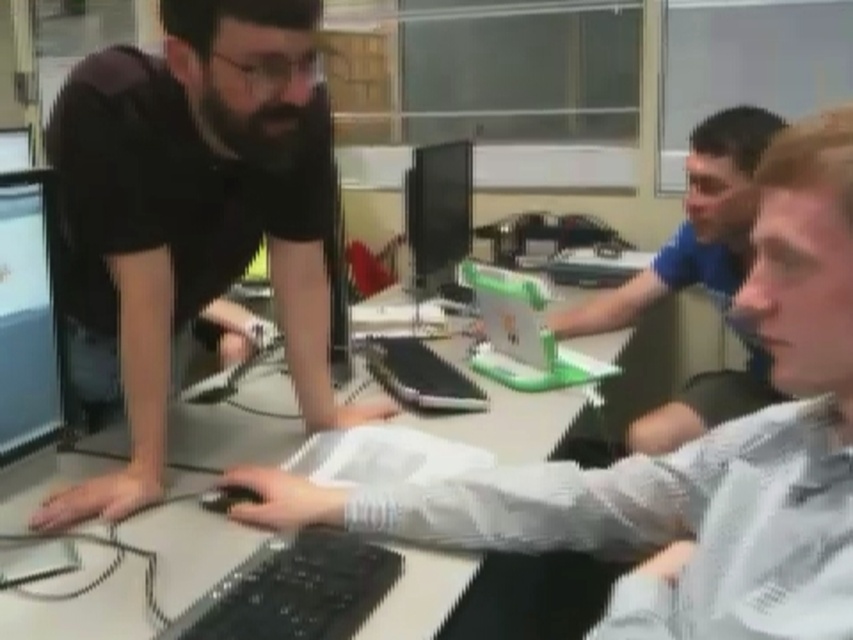
Is black plastic keyboard at lower center to the left of matte black monitor at left from the viewer's perspective?

Incorrect, black plastic keyboard at lower center is not on the left side of matte black monitor at left.

Is point (309, 605) farther from camera compared to point (59, 426)?

No.

Where is `black plastic keyboard at lower center`? black plastic keyboard at lower center is located at coordinates (293, 589).

At what (x,y) coordinates should I click in order to perform the action: click on matte black monitor at left. Please return your answer as a coordinate pair (x, y). Looking at the image, I should click on (27, 317).

Who is positioned more to the left, matte black monitor at left or matte black monitor at center?

matte black monitor at left

Is point (42, 307) positioned after point (405, 241)?

No, it is not.

Locate an element on the screen. This screenshot has width=853, height=640. matte black monitor at left is located at coordinates (x=27, y=317).

Is white glossy keyboard at center further to the viewer compared to black plastic keyboard at lower center?

No, it is not.

Is point (802, 497) less distant than point (241, 634)?

Yes, point (802, 497) is in front of point (241, 634).

Is point (827, 308) farther from viewer compared to point (260, 545)?

That is False.

At what (x,y) coordinates should I click in order to perform the action: click on white glossy keyboard at center. Please return your answer as a coordinate pair (x, y). The height and width of the screenshot is (640, 853). Looking at the image, I should click on (688, 452).